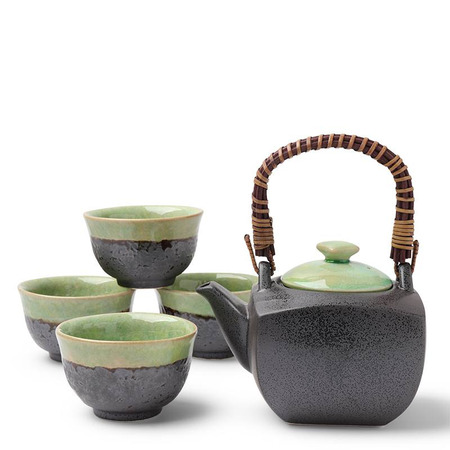
The image size is (450, 450). I want to click on cup stacked on top of other cups, so click(139, 237).